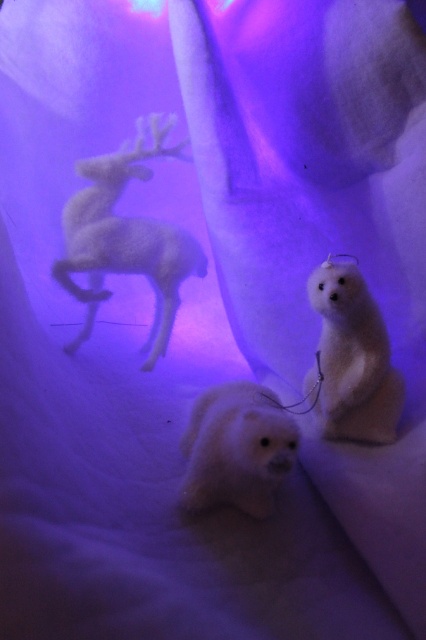
Question: Which object appears farthest from the camera in this image?

Choices:
 (A) white fluffy polar bear at center
 (B) white plush polar bear at center

Answer: (A)

Question: Which object is farther from the camera taking this photo?

Choices:
 (A) white plush polar bear at center
 (B) white fluffy polar bear at center

Answer: (B)

Question: Is white fluffy polar bear at center smaller than white plush polar bear at center?

Choices:
 (A) no
 (B) yes

Answer: (B)

Question: Is white fluffy polar bear at center thinner than white plush polar bear at center?

Choices:
 (A) no
 (B) yes

Answer: (B)

Question: Can you confirm if white fluffy polar bear at center is smaller than white plush polar bear at center?

Choices:
 (A) yes
 (B) no

Answer: (A)